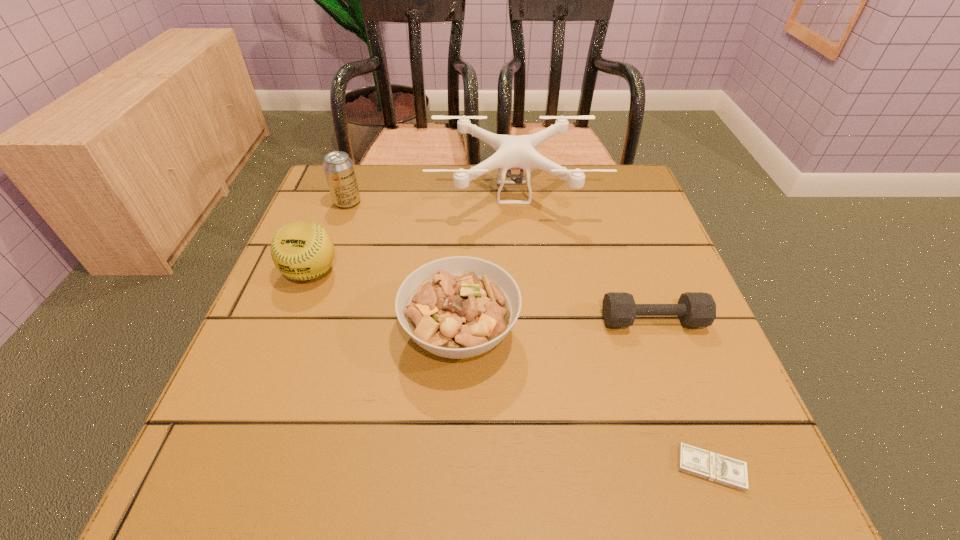
Locate an element on the screen. vacant region located 0.090m on the front of the stew is located at coordinates (456, 436).

At what (x,y) coordinates should I click in order to perform the action: click on vacant space located 0.220m on the left of the fifth tallest object. Please return your answer as a coordinate pair (x, y). Looking at the image, I should click on (486, 320).

Find the location of `vacant space situated 0.360m on the back of the nearest object`. vacant space situated 0.360m on the back of the nearest object is located at coordinates (640, 275).

This screenshot has height=540, width=960. In order to click on drone that is at the far edge in this screenshot , I will do `click(512, 152)`.

The height and width of the screenshot is (540, 960). Identify the location of beer can that is at the far edge. (338, 167).

Locate an element on the screen. The width and height of the screenshot is (960, 540). object positioned at the near edge is located at coordinates (692, 460).

I want to click on beer can that is positioned at the left edge, so click(338, 167).

Image resolution: width=960 pixels, height=540 pixels. Find the location of `softball at the left edge`. softball at the left edge is located at coordinates (302, 250).

Locate an element on the screen. The width and height of the screenshot is (960, 540). drone that is at the right edge is located at coordinates (512, 152).

This screenshot has height=540, width=960. I want to click on dumbbell present at the right edge, so click(x=695, y=309).